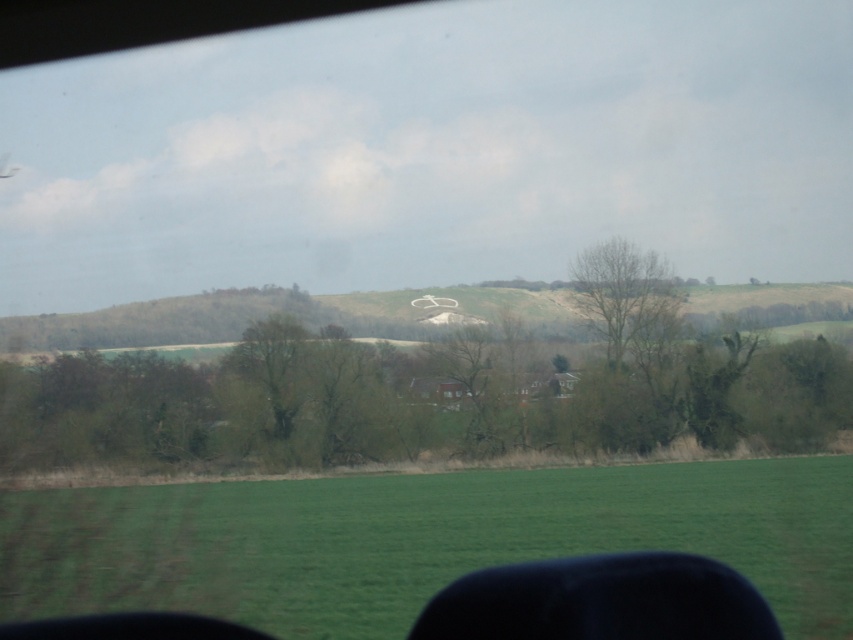
You are a passenger in a car and looking out the window. You see the green grass at lower center and the bare wood tree at center. Which object is closer to you?

The green grass at lower center is closer to you because it is positioned under the bare wood tree at center, meaning it is in front of the tree in the scene.

You are a passenger in a car driving through a rural area. You notice two points marked on the window. The first point is at coordinate point (21, 618) and the second at point (611, 269). Based on the scene, which point is closer to you?

Point (21, 618) is in front of point (611, 269), so it is closer to you.

You are driving a car and want to know how far the green grass at lower center is from your current position. Can you determine the distance using the information provided?

The green grass at lower center is 8.61 meters away from the viewer, so yes, the distance can be determined as 8.61 meters.